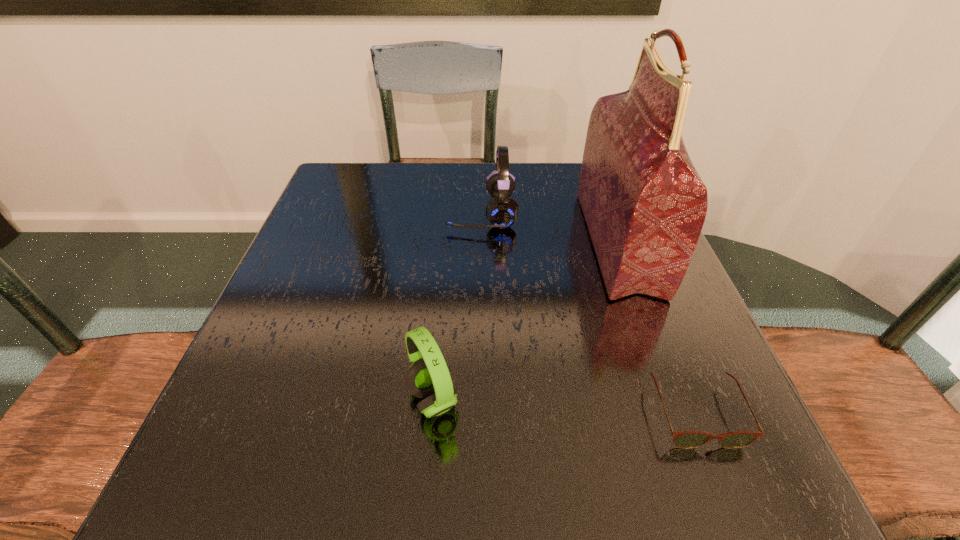
Locate an element on the screen. This screenshot has width=960, height=540. vacant area at the left edge of the desktop is located at coordinates (313, 310).

Where is `vacant space at the far left corner`? This screenshot has height=540, width=960. vacant space at the far left corner is located at coordinates (331, 172).

Find the location of a particular element. The width and height of the screenshot is (960, 540). blank space at the far right corner of the desktop is located at coordinates (574, 189).

This screenshot has width=960, height=540. In the image, there is a desktop. What are the coordinates of `vacant space at the near right corner` in the screenshot? It's located at (686, 463).

Locate an element on the screen. This screenshot has height=540, width=960. free space between the tallest object and the nearer headset is located at coordinates (525, 320).

The height and width of the screenshot is (540, 960). Find the location of `vacant space that is in between the handbag and the farther headset`. vacant space that is in between the handbag and the farther headset is located at coordinates (549, 227).

Identify the location of vacant space that is in between the farther headset and the spectacles. This screenshot has height=540, width=960. tap(588, 313).

Locate an element on the screen. free space that is in between the nearer headset and the tallest object is located at coordinates (525, 320).

What are the coordinates of `free spot between the spectacles and the nearer headset` in the screenshot? It's located at 564,407.

Locate an element on the screen. The height and width of the screenshot is (540, 960). vacant area that lies between the spectacles and the nearer headset is located at coordinates (564, 407).